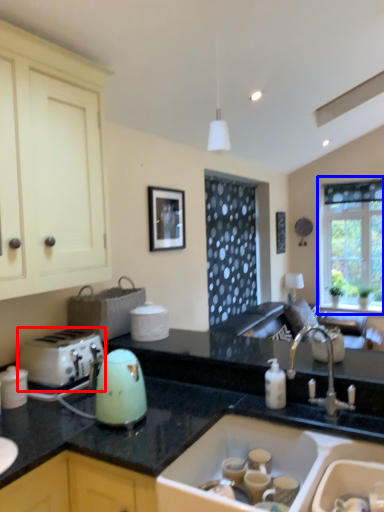
Question: Among these objects, which one is nearest to the camera, toaster (highlighted by a red box) or window (highlighted by a blue box)?

Choices:
 (A) toaster
 (B) window

Answer: (A)